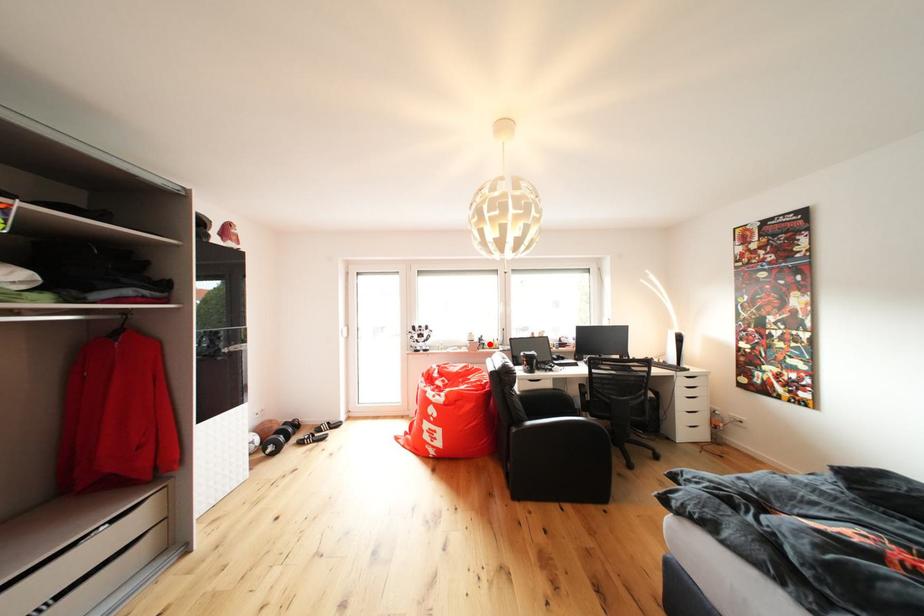
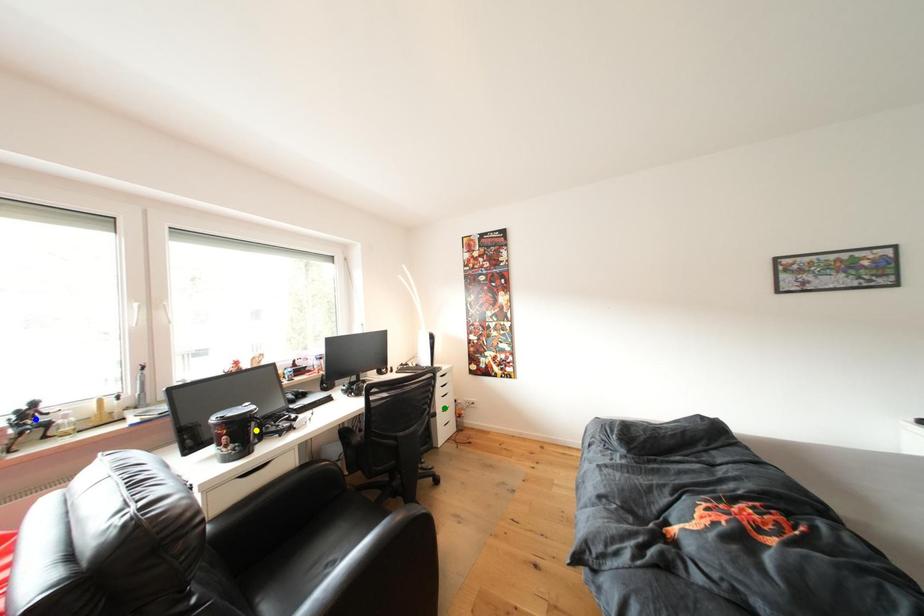
Question: I am providing you with two images of the same scene from different viewpoints. A red point is marked on the first image. You are given multiple points on the second image. Which point in image 2 is actually the same real-world point as the red point in image 1?

Choices:
 (A) yellow point
 (B) blue point
 (C) green point

Answer: (B)